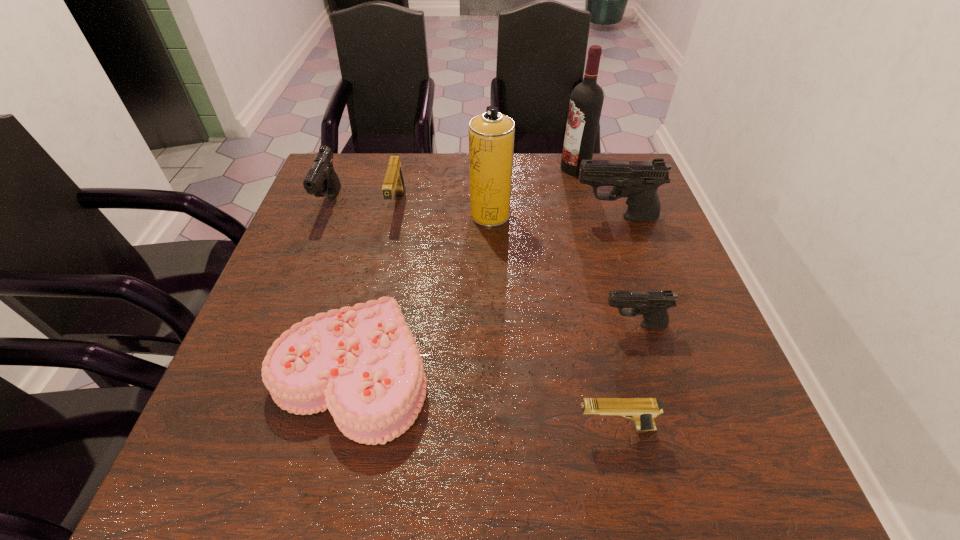
Find the location of a particular element. This screenshot has width=960, height=540. wine bottle that is at the far edge is located at coordinates (586, 101).

Locate an element on the screen. The image size is (960, 540). object at the near edge is located at coordinates (362, 363).

This screenshot has height=540, width=960. I want to click on pistol present at the left edge, so click(x=321, y=178).

Find the location of a particular element. cake situated at the left edge is located at coordinates (362, 363).

Find the location of a particular element. The height and width of the screenshot is (540, 960). wine bottle that is at the right edge is located at coordinates (586, 101).

Where is `object located at the far left corner`? Image resolution: width=960 pixels, height=540 pixels. object located at the far left corner is located at coordinates (321, 178).

The height and width of the screenshot is (540, 960). I want to click on object that is at the near left corner, so click(362, 363).

Image resolution: width=960 pixels, height=540 pixels. Identify the location of object that is positioned at the far right corner. (586, 101).

This screenshot has width=960, height=540. In the image, there is a desktop. What are the coordinates of `vacant space at the far edge` in the screenshot? It's located at (440, 189).

The height and width of the screenshot is (540, 960). I want to click on vacant space at the left edge of the desktop, so click(x=323, y=210).